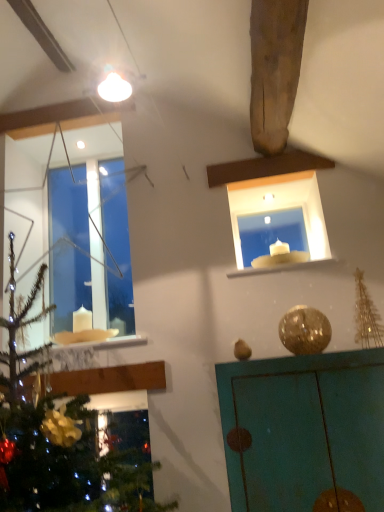
Question: In the image, is teal painted cabinet at upper right positioned in front of or behind transparent glass window at upper left?

Choices:
 (A) behind
 (B) front

Answer: (B)

Question: Is point (264, 413) positioned closer to the camera than point (61, 278)?

Choices:
 (A) farther
 (B) closer

Answer: (B)

Question: Estimate the real-world distances between objects in this image. Which object is farther from the transparent glass window at upper left?

Choices:
 (A) teal painted cabinet at upper right
 (B) white glass candle at upper center
 (C) white marble window sill at upper center

Answer: (A)

Question: Considering the real-world distances, which object is farthest from the white marble window sill at upper center?

Choices:
 (A) teal painted cabinet at upper right
 (B) transparent glass window at upper left
 (C) white glass candle at upper center

Answer: (B)